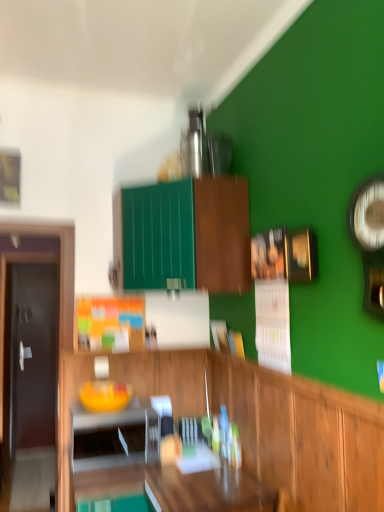
Question: Does green matte cabinet at upper center, marked as the first cabinetry in a top-to-bottom arrangement, have a lesser width compared to white glossy microwave at lower left?

Choices:
 (A) no
 (B) yes

Answer: (A)

Question: Can we say green matte cabinet at upper center, marked as the first cabinetry in a top-to-bottom arrangement, lies outside white glossy microwave at lower left?

Choices:
 (A) no
 (B) yes

Answer: (B)

Question: Is green matte cabinet at upper center, the second cabinetry positioned from the bottom, in front of white glossy microwave at lower left?

Choices:
 (A) no
 (B) yes

Answer: (B)

Question: From a real-world perspective, is green matte cabinet at upper center, marked as the first cabinetry in a top-to-bottom arrangement, over white glossy microwave at lower left?

Choices:
 (A) yes
 (B) no

Answer: (A)

Question: Is green matte cabinet at upper center, the second cabinetry positioned from the bottom, turned away from white glossy microwave at lower left?

Choices:
 (A) yes
 (B) no

Answer: (B)

Question: Considering the positions of point [x=163, y=183] and point [x=380, y=309], is point [x=163, y=183] closer or farther from the camera than point [x=380, y=309]?

Choices:
 (A) farther
 (B) closer

Answer: (A)

Question: From the image's perspective, is green matte cabinet at upper center, marked as the first cabinetry in a top-to-bottom arrangement, positioned above or below metallic silver clock at right?

Choices:
 (A) below
 (B) above

Answer: (B)

Question: From a real-world perspective, is green matte cabinet at upper center, marked as the first cabinetry in a top-to-bottom arrangement, positioned above or below metallic silver clock at right?

Choices:
 (A) above
 (B) below

Answer: (A)

Question: Is green matte cabinet at upper center, marked as the first cabinetry in a top-to-bottom arrangement, taller or shorter than metallic silver clock at right?

Choices:
 (A) tall
 (B) short

Answer: (A)

Question: Considering the positions of metallic silver clock at right and wooden cabinet at center, the 2th cabinetry positioned from the top, in the image, is metallic silver clock at right wider or thinner than wooden cabinet at center, the 2th cabinetry positioned from the top,?

Choices:
 (A) thin
 (B) wide

Answer: (A)

Question: From the image's perspective, relative to wooden cabinet at center, placed as the 1th cabinetry when sorted from bottom to top, is metallic silver clock at right above or below?

Choices:
 (A) above
 (B) below

Answer: (A)

Question: From a real-world perspective, relative to wooden cabinet at center, the 2th cabinetry positioned from the top, is metallic silver clock at right vertically above or below?

Choices:
 (A) above
 (B) below

Answer: (A)

Question: Do you think metallic silver clock at right is within wooden cabinet at center, the 2th cabinetry positioned from the top, or outside of it?

Choices:
 (A) inside
 (B) outside

Answer: (B)

Question: From a real-world perspective, is wooden cabinet at center, placed as the 1th cabinetry when sorted from bottom to top, positioned above or below wooden table at center?

Choices:
 (A) below
 (B) above

Answer: (B)

Question: In terms of width, does wooden cabinet at center, the 2th cabinetry positioned from the top, look wider or thinner when compared to wooden table at center?

Choices:
 (A) wide
 (B) thin

Answer: (B)